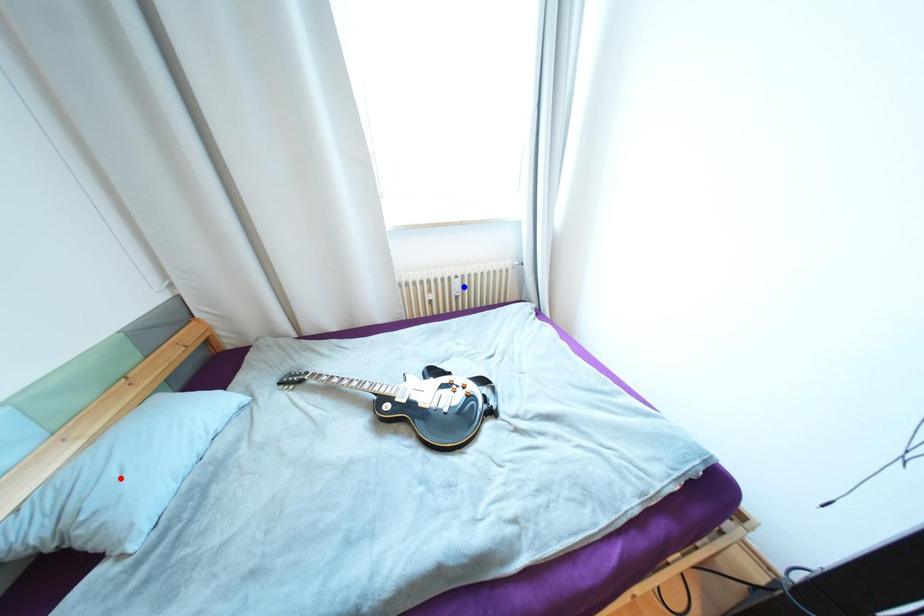
Question: Which of the two points in the image is closer to the camera?

Choices:
 (A) Blue point is closer.
 (B) Red point is closer.

Answer: (B)